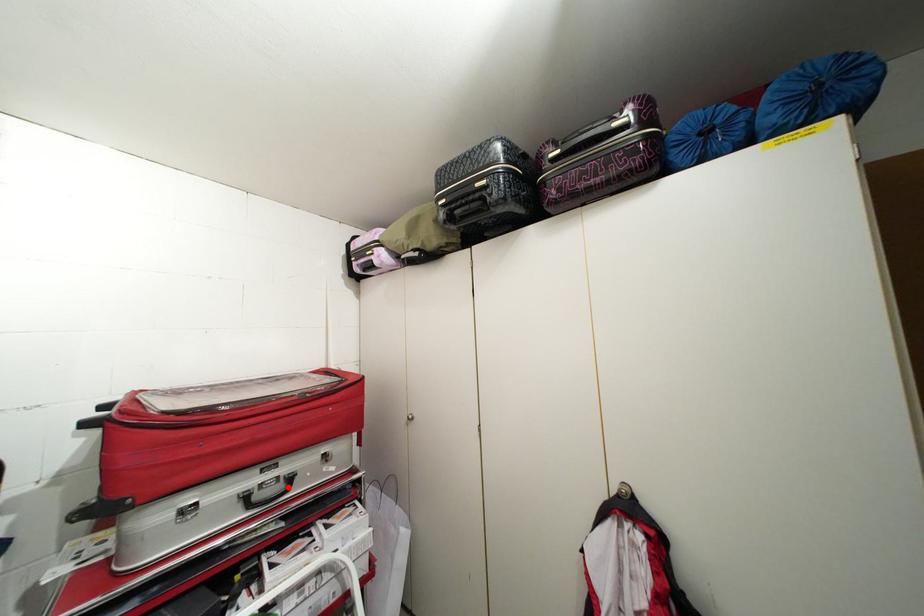
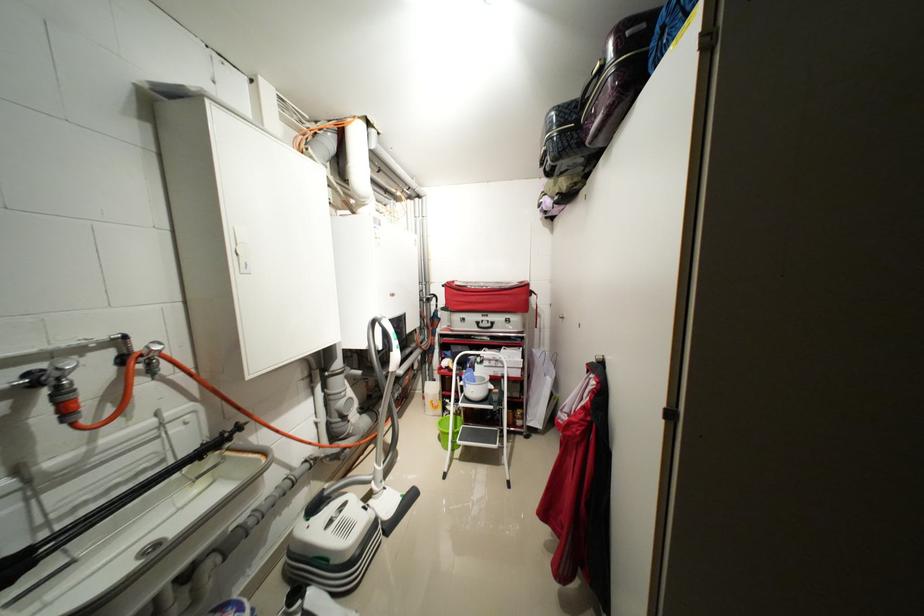
Find the pixel in the second image that matches the highlighted location in the first image.

(496, 326)